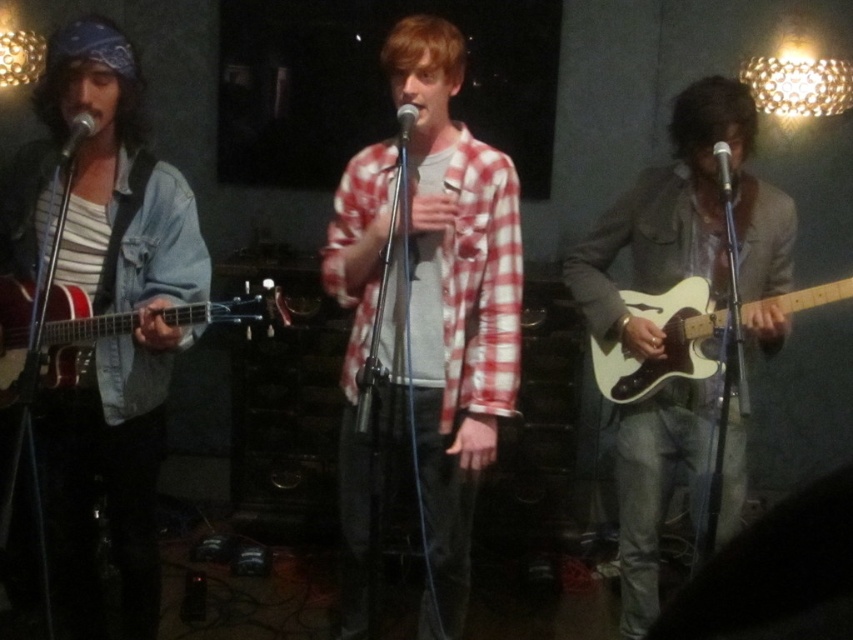
You are a stagehand who needs to adjust the lighting for the guitarist playing the white matte electric guitar at right. Since the microphone stand for the matte black microphone at left might block the light, can you move the light so it shines directly on the guitar without hitting the microphone?

The white matte electric guitar at right is in front of the matte black microphone at left, so moving the light to shine directly on the guitar would also illuminate the microphone since it is behind the guitar. Adjust the angle so the light hits the guitar but avoids the microphone stand.

Based on the photo, you are a stagehand who needs to adjust the distance between the metallic silver microphone at center and the matte black microphone at center to exactly 1 meter. Currently, they are 76.34 centimeters apart. How much space do you need to add or subtract to achieve the desired distance?

The current distance between the metallic silver microphone at center and the matte black microphone at center is 76.34 centimeters. To reach 1 meter, you need to add 23.66 centimeters between them.

You are a photographer in the audience trying to capture the performer wearing the checkered fabric shirt at center and holding the metallic silver microphone at center. If you want to ensure both are in frame, which object should you focus on first to avoid cropping either?

The checkered fabric shirt at center might be wider than metallic silver microphone at center, so you should focus on the checkered fabric shirt at center first to ensure it fits within the frame.